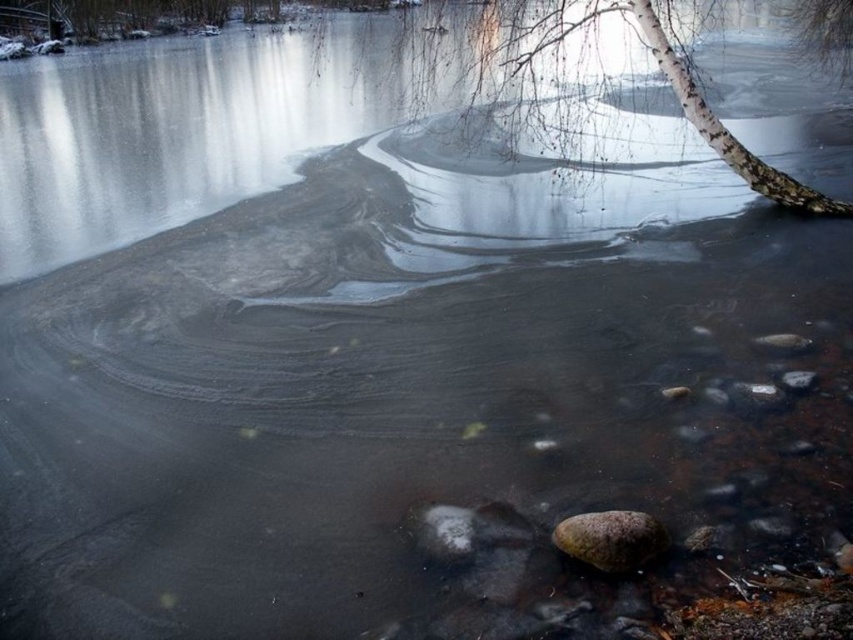
Who is positioned more to the left, white bark tree at upper right or rusty metallic rock at lower right?

From the viewer's perspective, rusty metallic rock at lower right appears more on the left side.

Which of these two, white bark tree at upper right or rusty metallic rock at lower right, stands taller?

white bark tree at upper right

Between point (724, 140) and point (612, 548), which one is positioned in front?

Point (612, 548) is more forward.

Locate an element on the screen. This screenshot has height=640, width=853. white bark tree at upper right is located at coordinates (589, 51).